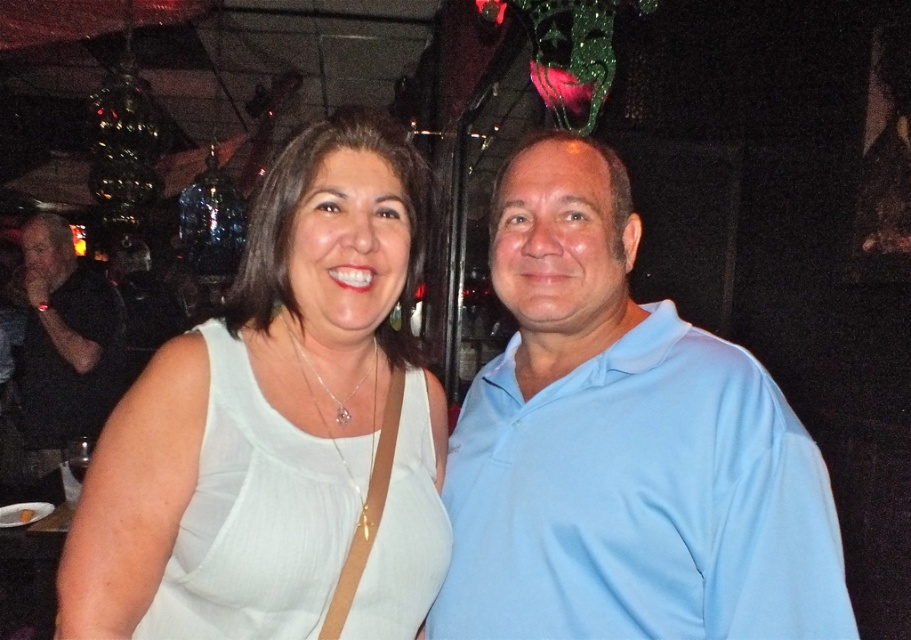
Which of these two, white fabric dress at center or black shirt at left, stands shorter?

white fabric dress at center is shorter.

Is point (306, 289) farther from viewer compared to point (48, 461)?

No, (306, 289) is closer to viewer.

What do you see at coordinates (275, 420) in the screenshot? I see `white fabric dress at center` at bounding box center [275, 420].

Identify the location of white fabric dress at center. (275, 420).

Can you confirm if light blue cotton shirt at center is positioned below white fabric dress at center?

Yes, light blue cotton shirt at center is below white fabric dress at center.

Who is positioned more to the left, light blue cotton shirt at center or white fabric dress at center?

white fabric dress at center is more to the left.

At what (x,y) coordinates should I click in order to perform the action: click on light blue cotton shirt at center. Please return your answer as a coordinate pair (x, y). Looking at the image, I should click on (622, 448).

Does light blue cotton shirt at center have a smaller size compared to black shirt at left?

Yes.

Is light blue cotton shirt at center thinner than black shirt at left?

Yes.

Image resolution: width=911 pixels, height=640 pixels. Identify the location of light blue cotton shirt at center. (622, 448).

The width and height of the screenshot is (911, 640). I want to click on light blue cotton shirt at center, so click(622, 448).